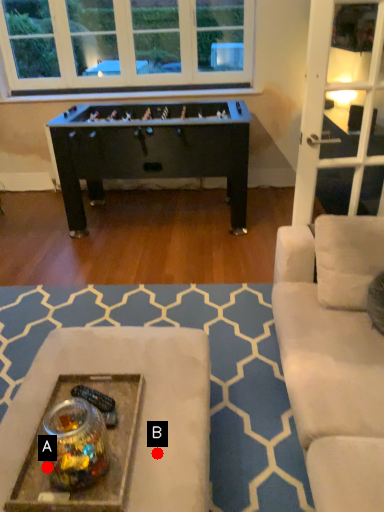
Question: Two points are circled on the image, labeled by A and B beside each circle. Which point is closer to the camera?

Choices:
 (A) A is closer
 (B) B is closer

Answer: (A)